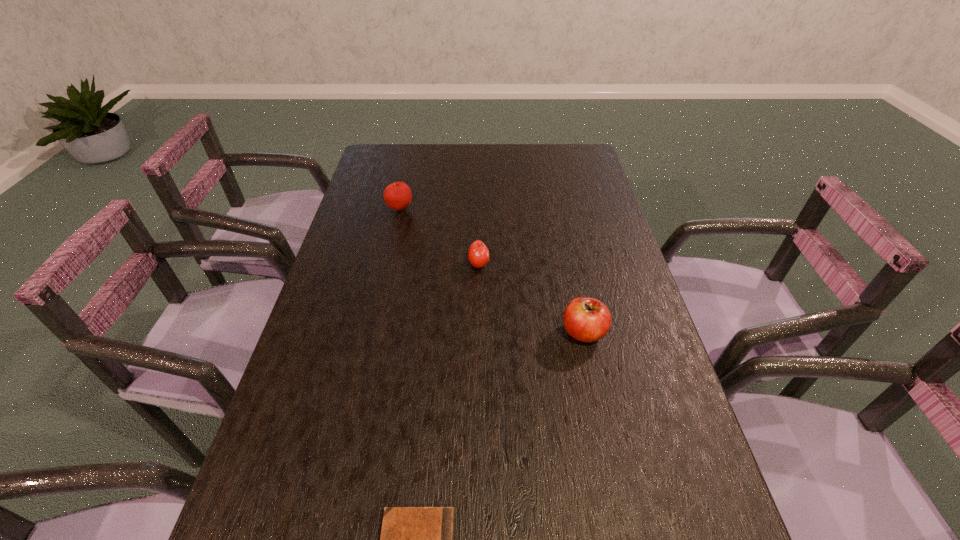
Locate which object is the closest to the second nearest apple. Please provide its 2D coordinates. Your answer should be formatted as a tuple, i.e. [(x, y)], where the tuple contains the x and y coordinates of a point satisfying the conditions above.

[(586, 319)]

Identify which object is located as the nearest to the second apple from left to right. Please provide its 2D coordinates. Your answer should be formatted as a tuple, i.e. [(x, y)], where the tuple contains the x and y coordinates of a point satisfying the conditions above.

[(586, 319)]

Point out which apple is positioned as the second nearest to the nearest apple. Please provide its 2D coordinates. Your answer should be formatted as a tuple, i.e. [(x, y)], where the tuple contains the x and y coordinates of a point satisfying the conditions above.

[(397, 196)]

Locate which apple ranks in proximity to the second object from right to left. Please provide its 2D coordinates. Your answer should be formatted as a tuple, i.e. [(x, y)], where the tuple contains the x and y coordinates of a point satisfying the conditions above.

[(586, 319)]

This screenshot has height=540, width=960. In order to click on free space that satisfies the following two spatial constraints: 1. on the front side of the rightmost object; 2. on the left side of the shortest apple in this screenshot , I will do `click(478, 333)`.

Locate an element on the screen. free point that satisfies the following two spatial constraints: 1. on the front side of the rightmost object; 2. on the left side of the leftmost object is located at coordinates (372, 333).